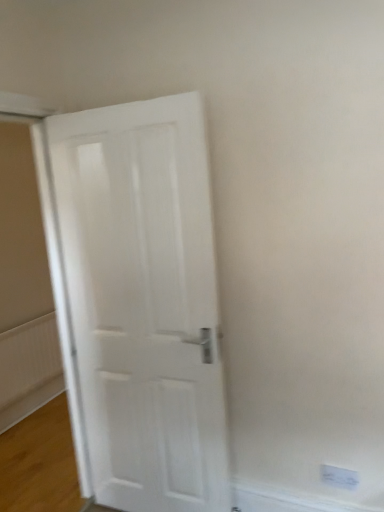
Question: Does white textured radiator at lower left have a greater width compared to white plastic electric outlet at lower right?

Choices:
 (A) no
 (B) yes

Answer: (B)

Question: Considering the relative sizes of white textured radiator at lower left and white plastic electric outlet at lower right in the image provided, is white textured radiator at lower left bigger than white plastic electric outlet at lower right?

Choices:
 (A) yes
 (B) no

Answer: (A)

Question: From the image's perspective, is white textured radiator at lower left under white plastic electric outlet at lower right?

Choices:
 (A) no
 (B) yes

Answer: (A)

Question: Can you confirm if white textured radiator at lower left is thinner than white plastic electric outlet at lower right?

Choices:
 (A) no
 (B) yes

Answer: (A)

Question: Does white textured radiator at lower left contain white plastic electric outlet at lower right?

Choices:
 (A) yes
 (B) no

Answer: (B)

Question: From the image's perspective, relative to white matte door at center, is white plastic electric outlet at lower right above or below?

Choices:
 (A) below
 (B) above

Answer: (A)

Question: In terms of width, does white plastic electric outlet at lower right look wider or thinner when compared to white matte door at center?

Choices:
 (A) thin
 (B) wide

Answer: (A)

Question: Based on their sizes in the image, would you say white plastic electric outlet at lower right is bigger or smaller than white matte door at center?

Choices:
 (A) small
 (B) big

Answer: (A)

Question: From a real-world perspective, is white plastic electric outlet at lower right positioned above or below white matte door at center?

Choices:
 (A) below
 (B) above

Answer: (A)

Question: Visually, is white textured radiator at lower left positioned to the left or to the right of white plastic electric outlet at lower right?

Choices:
 (A) left
 (B) right

Answer: (A)

Question: Which is correct: white textured radiator at lower left is inside white plastic electric outlet at lower right, or outside of it?

Choices:
 (A) inside
 (B) outside

Answer: (B)

Question: In terms of size, does white textured radiator at lower left appear bigger or smaller than white plastic electric outlet at lower right?

Choices:
 (A) small
 (B) big

Answer: (B)

Question: Is white textured radiator at lower left taller or shorter than white plastic electric outlet at lower right?

Choices:
 (A) short
 (B) tall

Answer: (B)

Question: Would you say white matte door at center is to the left or to the right of white textured radiator at lower left in the picture?

Choices:
 (A) left
 (B) right

Answer: (B)

Question: Considering the positions of white matte door at center and white textured radiator at lower left in the image, is white matte door at center bigger or smaller than white textured radiator at lower left?

Choices:
 (A) small
 (B) big

Answer: (B)